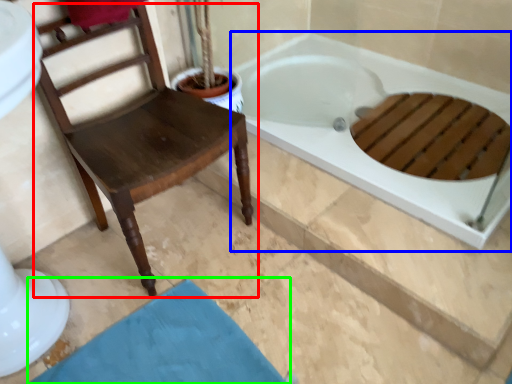
Question: Based on their relative distances, which object is farther from chair (highlighted by a red box)? Choose from bathtub (highlighted by a blue box) and bath mat (highlighted by a green box).

Choices:
 (A) bathtub
 (B) bath mat

Answer: (A)